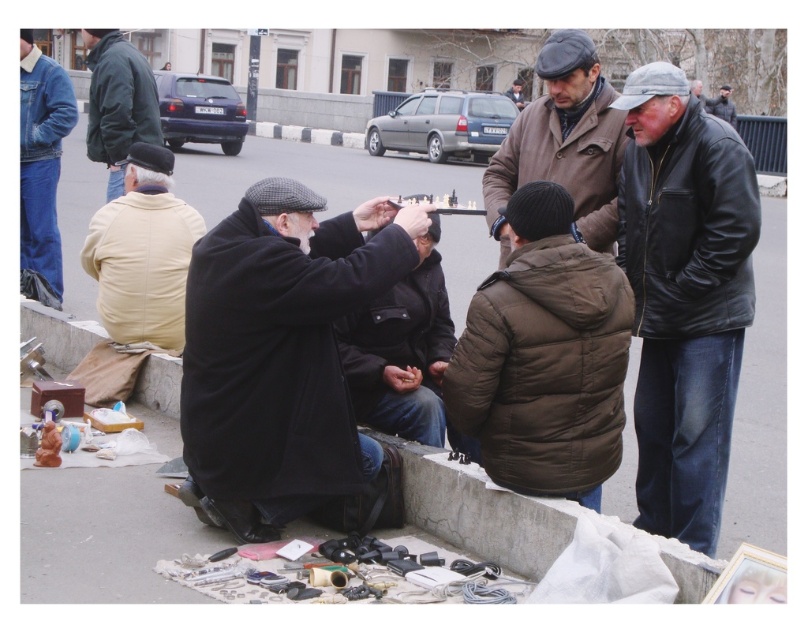
Question: Which object is closer to the camera taking this photo?

Choices:
 (A) black leather jacket at right
 (B) brown puffy jacket at center
 (C) blue denim jacket at upper left
 (D) brown leather jacket at upper center

Answer: (B)

Question: Does black leather jacket at right appear under brown puffy jacket at center?

Choices:
 (A) yes
 (B) no

Answer: (B)

Question: Is light beige jacket at left smaller than blue denim jacket at upper left?

Choices:
 (A) yes
 (B) no

Answer: (A)

Question: Does black matte coat at center come in front of leather jacket at upper right?

Choices:
 (A) yes
 (B) no

Answer: (A)

Question: Which of these objects is positioned farthest from the blue denim jacket at upper left?

Choices:
 (A) light beige jacket at left
 (B) brown puffy jacket at center

Answer: (B)

Question: Which object is closer to the camera taking this photo?

Choices:
 (A) brown leather jacket at upper center
 (B) black matte coat at center
 (C) black wool coat at center
 (D) dark green jacket at upper left

Answer: (C)